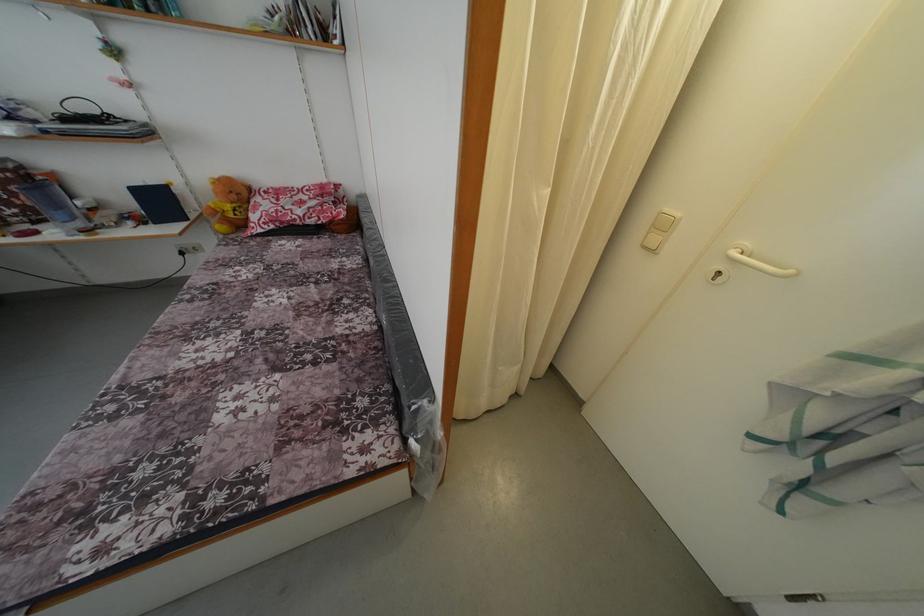
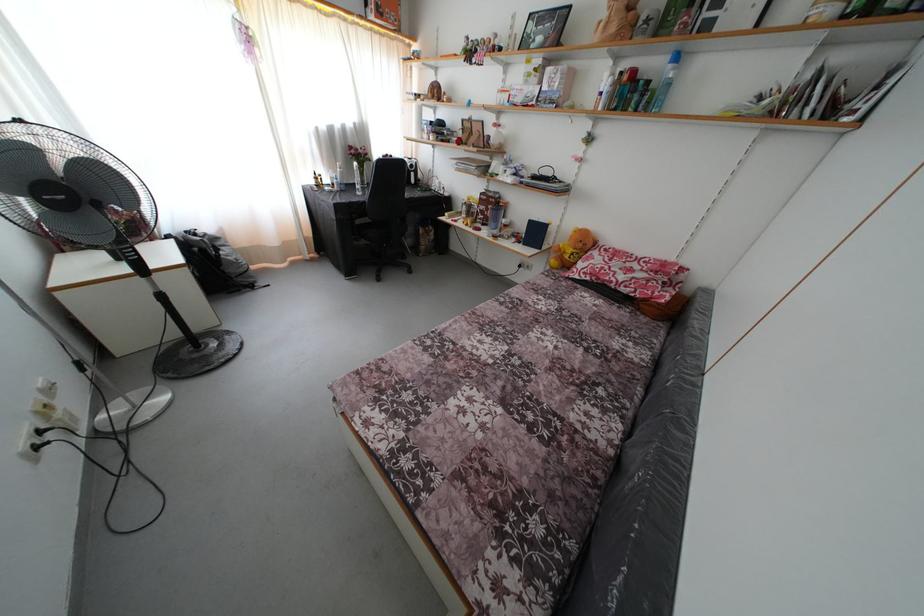
Locate, in the second image, the point that corresponds to point (239, 203) in the first image.

(585, 251)